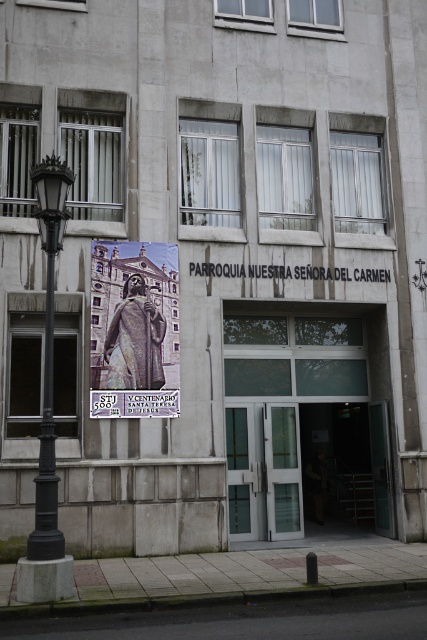
You are standing in front of the building and see the point marked at coordinates (134, 330). What object is located at that point?

The point at coordinates (134, 330) corresponds to the matte bronze statue at center.

You are a visitor standing in front of the PARROQUIA NUESTRA SE?ORA DEL CARMEN. You notice the matte bronze statue at center and the black cast iron streetlight at left. Which object is shorter?

The matte bronze statue at center is shorter than the black cast iron streetlight at left.

You are a visitor approaching the entrance of PARROQUIA NUESTRA SE. You notice the matte bronze statue at center and the black cast iron streetlight at left. Which object would appear bigger to you as you stand in front of the entrance?

The matte bronze statue at center is larger in size than the black cast iron streetlight at left, so the matte bronze statue at center would appear bigger to you as you stand in front of the entrance.